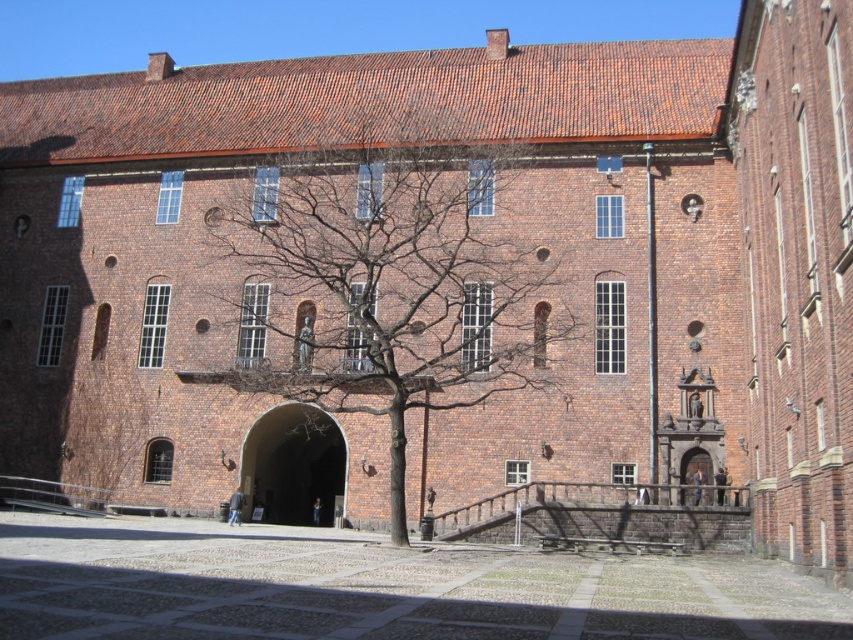
Question: Is bare branches at center below wooden door at center?

Choices:
 (A) no
 (B) yes

Answer: (A)

Question: Can you confirm if bare branches at center is thinner than wooden door at center?

Choices:
 (A) no
 (B) yes

Answer: (A)

Question: Which object is positioned closest to the bare branches at center?

Choices:
 (A) wooden door at center
 (B) brown stone archway at center

Answer: (B)

Question: Which object appears farthest from the camera in this image?

Choices:
 (A) brown stone archway at center
 (B) wooden door at center
 (C) bare branches at center

Answer: (A)

Question: Where is bare branches at center located in relation to brown stone archway at center in the image?

Choices:
 (A) above
 (B) below

Answer: (A)

Question: Which point is closer to the camera taking this photo?

Choices:
 (A) (680, 502)
 (B) (250, 246)

Answer: (A)